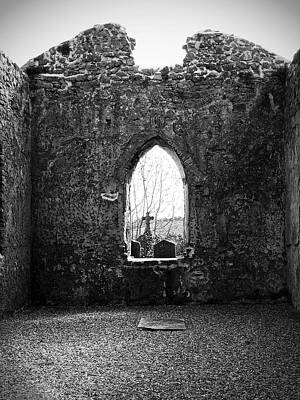
Locate an element on the screen. The height and width of the screenshot is (400, 300). wall is located at coordinates [69, 162], [13, 153], [291, 167].